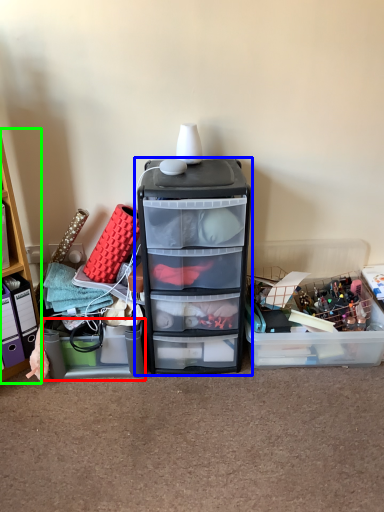
Question: Based on their relative distances, which object is farther from storage box (highlighted by a red box)? Choose from filing cabinet (highlighted by a blue box) and cabinetry (highlighted by a green box).

Choices:
 (A) filing cabinet
 (B) cabinetry

Answer: (A)